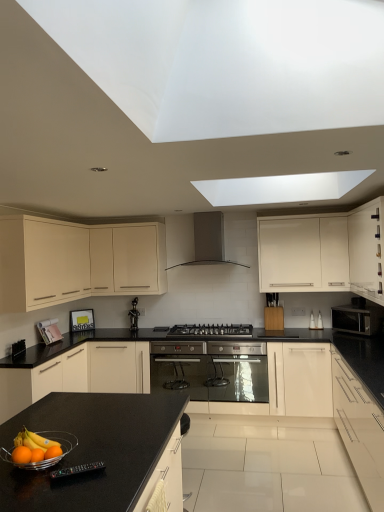
Question: From a real-world perspective, relative to black plastic remote control at lower left, the second appliance positioned from the bottom, is stainless steel oven at center, the 2th appliance viewed from the front, vertically above or below?

Choices:
 (A) below
 (B) above

Answer: (A)

Question: Considering the positions of stainless steel oven at center, the first appliance ordered from the bottom, and black plastic remote control at lower left, the second appliance positioned from the bottom, in the image, is stainless steel oven at center, the first appliance ordered from the bottom, bigger or smaller than black plastic remote control at lower left, the second appliance positioned from the bottom,?

Choices:
 (A) big
 (B) small

Answer: (A)

Question: Which of these objects is positioned closest to the stainless steel oven at center, acting as the 2th appliance starting from the back?

Choices:
 (A) matte white cabinet at upper center, positioned as the third cabinetry in left-to-right order
 (B) stainless steel gas stove at center
 (C) black granite countertop at lower left
 (D) matte cream cabinet at left, positioned as the 6th cabinetry in right-to-left order
 (E) black glossy statue at center, which appears as the 1th appliance when viewed from the top

Answer: (B)

Question: Which object is positioned closest to the black glossy statue at center, the 1th appliance when ordered from back to front?

Choices:
 (A) orange matte at lower left
 (B) white glossy cabinet at right, positioned as the 5th cabinetry in left-to-right order
 (C) matte cream cabinet at left, positioned as the first cabinetry in left-to-right order
 (D) matte black microwave at right
 (E) white matte cabinet at center, which is counted as the third cabinetry, starting from the right

Answer: (C)